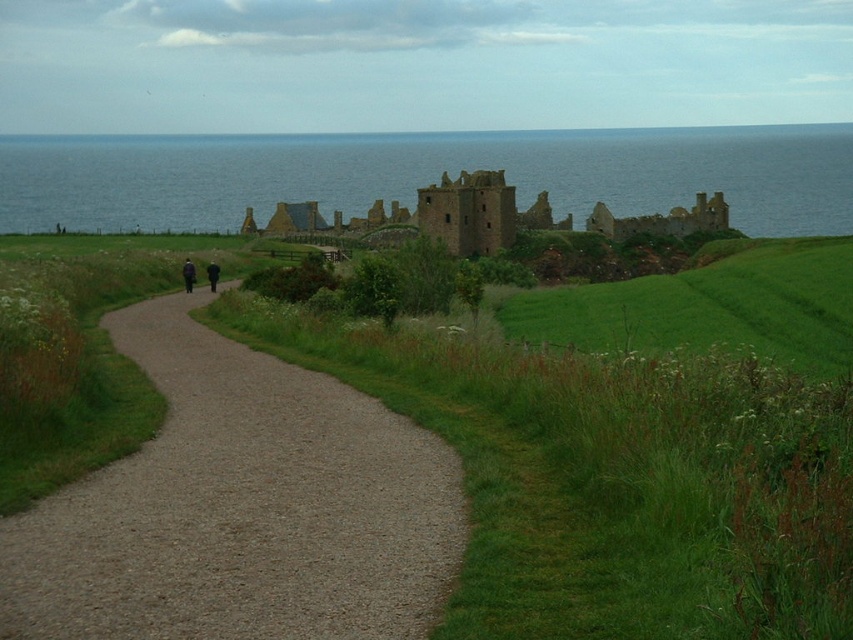
Question: Which object appears farthest from the camera in this image?

Choices:
 (A) brown stone ruins at center
 (B) dark blue fabric at left
 (C) blue water at upper center
 (D) gray gravel path at center

Answer: (C)

Question: Can you confirm if gray gravel path at center is positioned below blue water at upper center?

Choices:
 (A) no
 (B) yes

Answer: (B)

Question: From the image, what is the correct spatial relationship of blue water at upper center in relation to dark wool coat at center?

Choices:
 (A) below
 (B) above

Answer: (B)

Question: Does blue water at upper center appear over dark blue fabric at left?

Choices:
 (A) yes
 (B) no

Answer: (A)

Question: Which point is closer to the camera?

Choices:
 (A) blue water at upper center
 (B) dark wool coat at center
 (C) gray gravel path at center
 (D) brown stone ruins at center

Answer: (C)

Question: Estimate the real-world distances between objects in this image. Which object is closer to the dark blue fabric at left?

Choices:
 (A) blue water at upper center
 (B) gray gravel path at center
 (C) brown stone ruins at center
 (D) dark wool coat at center

Answer: (D)